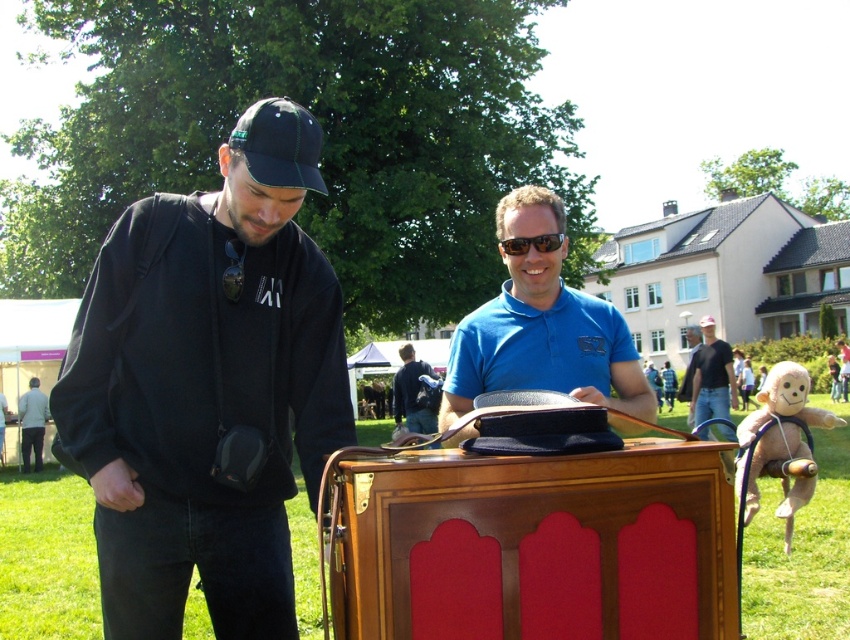
You are a photographer at the event and want to capture both the dark blue shirt at center and the blue smooth shirt at center in a single photo. Which shirt should you position to the left side of the frame to ensure both are visible?

The dark blue shirt at center should be positioned to the left side of the frame because it is already on the left side of the blue smooth shirt at center, ensuring both are visible.

You are taking a photo of the two points in the image. Which point, point (411, 364) or point (554, 236), will appear closer to the center of your camera view?

Point (411, 364) is further to the camera than point (554, 236), so it will appear closer to the center of your camera view.